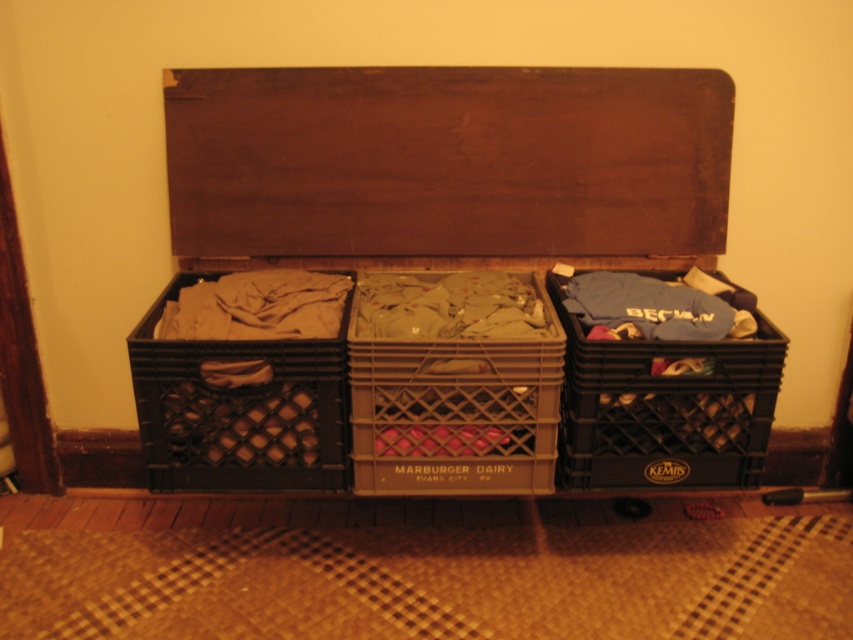
Does black plastic crate at right appear over black plastic crate at left?

Yes, black plastic crate at right is above black plastic crate at left.

Is black plastic crate at right further to the viewer compared to black plastic crate at left?

Yes, black plastic crate at right is further from the viewer.

Does point (741, 449) come closer to viewer compared to point (219, 348)?

No, (741, 449) is behind (219, 348).

You are a GUI agent. You are given a task and a screenshot of the screen. Output one action in this format:
    pyautogui.click(x=<x>, y=<y>)
    Task: Click on the black plastic crate at right
    
    Given the screenshot: What is the action you would take?
    pyautogui.click(x=664, y=406)

Looking at this image, can you confirm if matte plastic crate at center is bigger than blue cotton t-shirt at center right?

Correct, matte plastic crate at center is larger in size than blue cotton t-shirt at center right.

Does matte plastic crate at center lie in front of blue cotton t-shirt at center right?

Yes, matte plastic crate at center is closer to the viewer.

What do you see at coordinates (456, 410) in the screenshot? I see `matte plastic crate at center` at bounding box center [456, 410].

In order to click on matte plastic crate at center in this screenshot , I will do `click(456, 410)`.

Does black plastic crate at center appear over matte plastic crate at center?

Yes.

What do you see at coordinates (447, 166) in the screenshot?
I see `black plastic crate at center` at bounding box center [447, 166].

Locate an element on the screen. This screenshot has width=853, height=640. black plastic crate at center is located at coordinates (x=447, y=166).